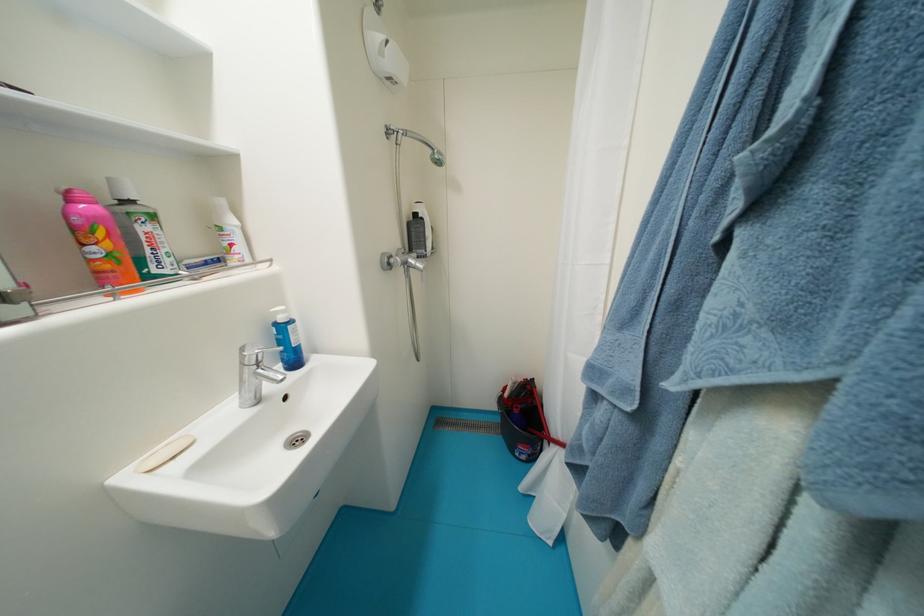
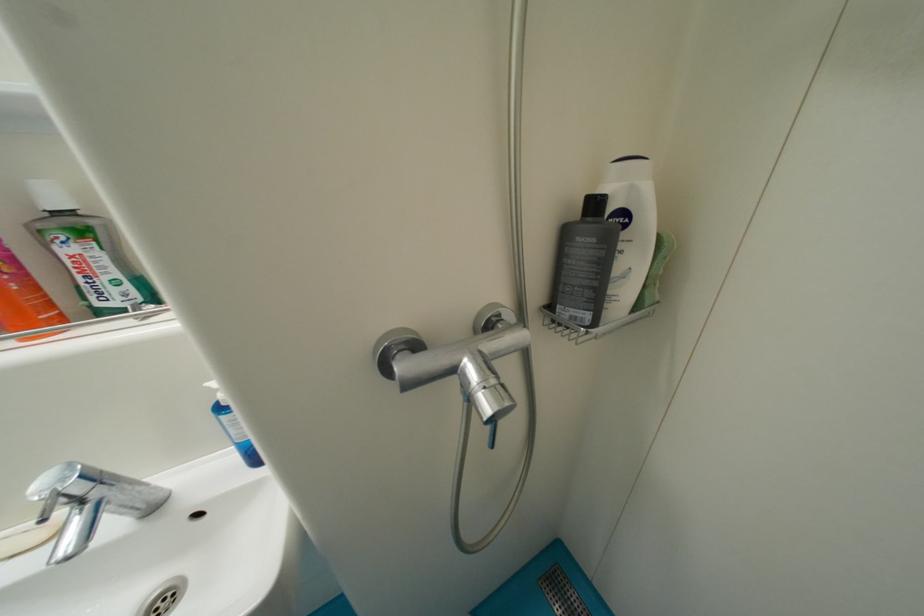
Question: The camera is either moving clockwise (left) or counter-clockwise (right) around the object. The first image is from the beginning of the video and the second image is from the end. Is the camera moving left or right when shooting the video?

Choices:
 (A) Left
 (B) Right

Answer: (B)